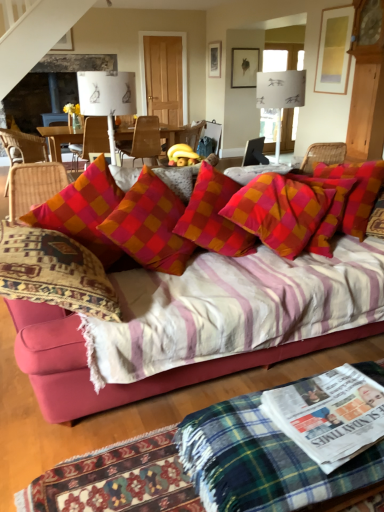
Question: Does wooden chair at center, positioned as the 3th chair in right-to-left order, have a larger size compared to plaid fabric pillow at center, the 2th pillow positioned from the left?

Choices:
 (A) yes
 (B) no

Answer: (B)

Question: Can you confirm if wooden chair at center, acting as the second chair starting from the left, is smaller than plaid fabric pillow at center, which appears as the 1th pillow when viewed from the right?

Choices:
 (A) yes
 (B) no

Answer: (A)

Question: Considering the relative sizes of wooden chair at center, positioned as the 3th chair in right-to-left order, and plaid fabric pillow at center, which appears as the 1th pillow when viewed from the right, in the image provided, is wooden chair at center, positioned as the 3th chair in right-to-left order, thinner than plaid fabric pillow at center, which appears as the 1th pillow when viewed from the right,?

Choices:
 (A) yes
 (B) no

Answer: (B)

Question: From a real-world perspective, does wooden chair at center, acting as the second chair starting from the left, sit lower than plaid fabric pillow at center, which appears as the 1th pillow when viewed from the right?

Choices:
 (A) yes
 (B) no

Answer: (B)

Question: From the image's perspective, is wooden chair at center, positioned as the 3th chair in right-to-left order, over plaid fabric pillow at center, the 2th pillow positioned from the left?

Choices:
 (A) no
 (B) yes

Answer: (B)

Question: Is plaid fabric pillow at center, the 2th pillow positioned from the left, taller or shorter than white paper lampshade at upper center, placed as the first lamp when sorted from left to right?

Choices:
 (A) short
 (B) tall

Answer: (B)

Question: From a real-world perspective, is plaid fabric pillow at center, the 2th pillow positioned from the left, physically located above or below white paper lampshade at upper center, placed as the first lamp when sorted from left to right?

Choices:
 (A) below
 (B) above

Answer: (A)

Question: Choose the correct answer: Is plaid fabric pillow at center, the 2th pillow positioned from the left, inside white paper lampshade at upper center, placed as the first lamp when sorted from left to right, or outside it?

Choices:
 (A) inside
 (B) outside

Answer: (B)

Question: In terms of size, does plaid fabric pillow at center, the 2th pillow positioned from the left, appear bigger or smaller than white paper lampshade at upper center, the second lamp in the right-to-left sequence?

Choices:
 (A) big
 (B) small

Answer: (A)

Question: Considering their positions, is white paper lampshade at upper center, the second lamp in the right-to-left sequence, located in front of or behind wooden chair at center, positioned as the 3th chair in right-to-left order?

Choices:
 (A) front
 (B) behind

Answer: (A)

Question: From the image's perspective, is white paper lampshade at upper center, the second lamp in the right-to-left sequence, located above or below wooden chair at center, acting as the second chair starting from the left?

Choices:
 (A) below
 (B) above

Answer: (A)

Question: Considering the relative positions of white paper lampshade at upper center, the second lamp in the right-to-left sequence, and wooden chair at center, positioned as the 3th chair in right-to-left order, in the image provided, is white paper lampshade at upper center, the second lamp in the right-to-left sequence, to the left or to the right of wooden chair at center, positioned as the 3th chair in right-to-left order,?

Choices:
 (A) right
 (B) left

Answer: (A)

Question: Is white paper lampshade at upper center, the second lamp in the right-to-left sequence, wider or thinner than wooden chair at center, acting as the second chair starting from the left?

Choices:
 (A) wide
 (B) thin

Answer: (B)

Question: Does point (319, 436) appear closer or farther from the camera than point (218, 415)?

Choices:
 (A) closer
 (B) farther

Answer: (A)

Question: From a real-world perspective, relative to green plaid blanket at lower center, is white glossy newspaper at lower right vertically above or below?

Choices:
 (A) below
 (B) above

Answer: (B)